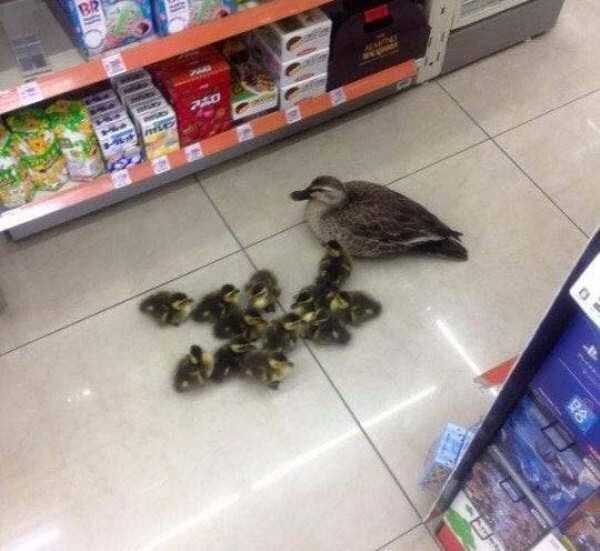
Where is `floor`? floor is located at coordinates pyautogui.click(x=466, y=95).